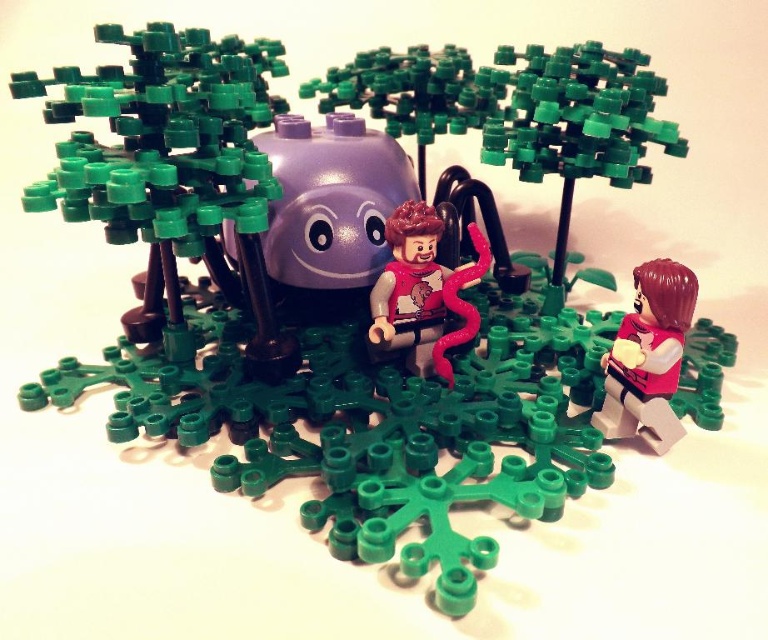
Question: Which object is farther from the camera taking this photo?

Choices:
 (A) smooth red vest at lower right
 (B) smooth red vest at center

Answer: (B)

Question: Does smooth red vest at lower right have a larger size compared to smooth red vest at center?

Choices:
 (A) no
 (B) yes

Answer: (A)

Question: Observing the image, what is the correct spatial positioning of smooth red vest at lower right in reference to smooth red vest at center?

Choices:
 (A) right
 (B) left

Answer: (A)

Question: Which point appears farthest from the camera in this image?

Choices:
 (A) (684, 314)
 (B) (392, 346)

Answer: (B)

Question: Among these points, which one is farthest from the camera?

Choices:
 (A) (422, 204)
 (B) (690, 285)

Answer: (A)

Question: Can you confirm if smooth red vest at lower right is smaller than smooth red vest at center?

Choices:
 (A) no
 (B) yes

Answer: (B)